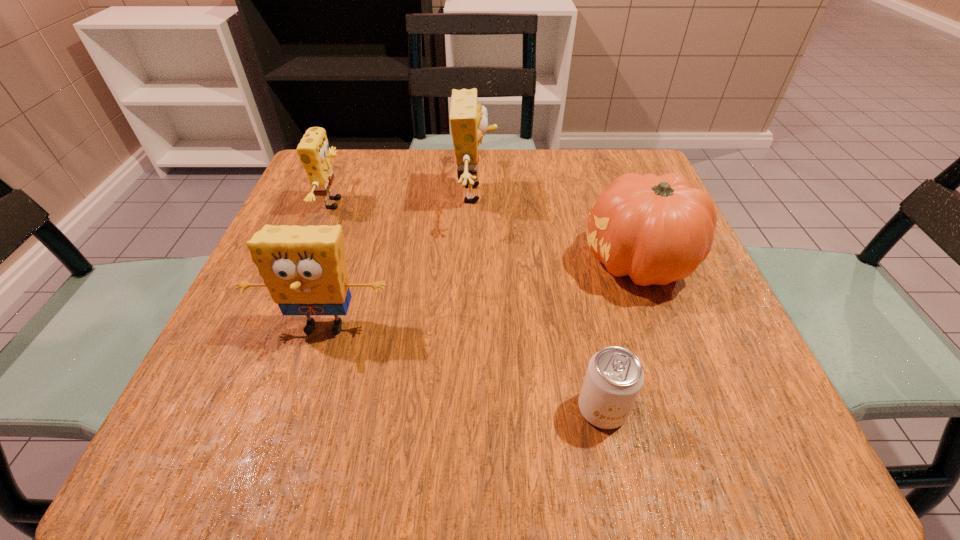
Find the location of `free space that satisfies the following two spatial constraints: 1. on the face of the shortest sponge; 2. on the left side of the shortest object`. free space that satisfies the following two spatial constraints: 1. on the face of the shortest sponge; 2. on the left side of the shortest object is located at coordinates (253, 409).